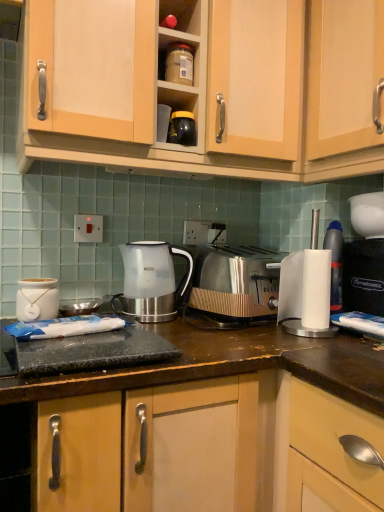
Question: From a real-world perspective, is black plastic bag at right physically below white ceramic jar at left?

Choices:
 (A) yes
 (B) no

Answer: (B)

Question: Can you confirm if black plastic bag at right is positioned to the left of white ceramic jar at left?

Choices:
 (A) no
 (B) yes

Answer: (A)

Question: Is black plastic bag at right further to the viewer compared to white ceramic jar at left?

Choices:
 (A) yes
 (B) no

Answer: (A)

Question: Would you say black plastic bag at right is outside white ceramic jar at left?

Choices:
 (A) yes
 (B) no

Answer: (A)

Question: Is black plastic bag at right bigger than white ceramic jar at left?

Choices:
 (A) yes
 (B) no

Answer: (A)

Question: Considering the relative sizes of black plastic bag at right and white ceramic jar at left in the image provided, is black plastic bag at right shorter than white ceramic jar at left?

Choices:
 (A) no
 (B) yes

Answer: (A)

Question: Considering the relative sizes of black plastic bag at right and translucent plastic kettle at center in the image provided, is black plastic bag at right bigger than translucent plastic kettle at center?

Choices:
 (A) no
 (B) yes

Answer: (A)

Question: Is black plastic bag at right oriented away from translucent plastic kettle at center?

Choices:
 (A) yes
 (B) no

Answer: (B)

Question: Is black plastic bag at right positioned beyond the bounds of translucent plastic kettle at center?

Choices:
 (A) no
 (B) yes

Answer: (B)

Question: Considering the relative sizes of black plastic bag at right and translucent plastic kettle at center in the image provided, is black plastic bag at right wider than translucent plastic kettle at center?

Choices:
 (A) yes
 (B) no

Answer: (A)

Question: Is black plastic bag at right directly adjacent to translucent plastic kettle at center?

Choices:
 (A) yes
 (B) no

Answer: (B)

Question: Considering the relative positions of black plastic bag at right and translucent plastic kettle at center in the image provided, is black plastic bag at right in front of translucent plastic kettle at center?

Choices:
 (A) no
 (B) yes

Answer: (B)

Question: Does wooden cabinet at upper center, marked as the 2th cabinetry in a right-to-left arrangement, have a larger size compared to white ceramic jar at left?

Choices:
 (A) yes
 (B) no

Answer: (A)